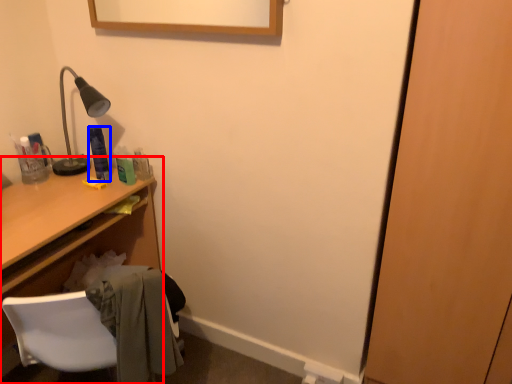
Question: Which object appears closest to the camera in this image, desk (highlighted by a red box) or toiletry (highlighted by a blue box)?

Choices:
 (A) desk
 (B) toiletry

Answer: (A)